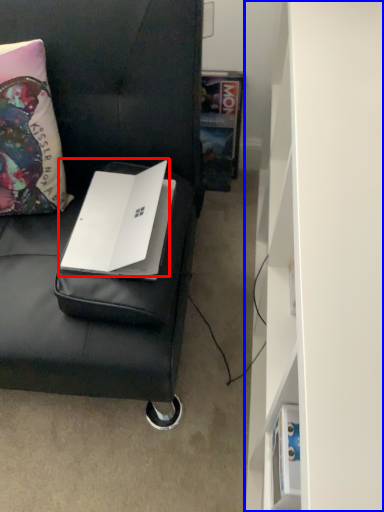
Question: Which of the following is the closest to the observer, laptop (highlighted by a red box) or bookshelf (highlighted by a blue box)?

Choices:
 (A) laptop
 (B) bookshelf

Answer: (B)